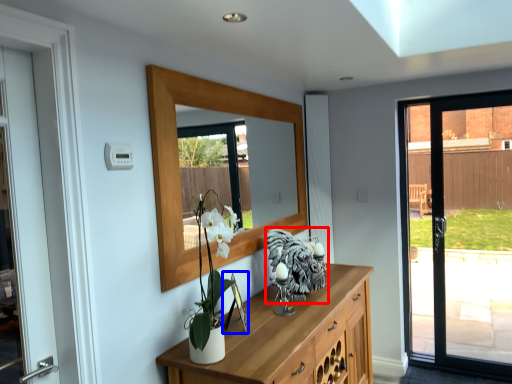
Question: Which object appears farthest to the camera in this image, animal (highlighted by a red box) or picture frame (highlighted by a blue box)?

Choices:
 (A) animal
 (B) picture frame

Answer: (A)